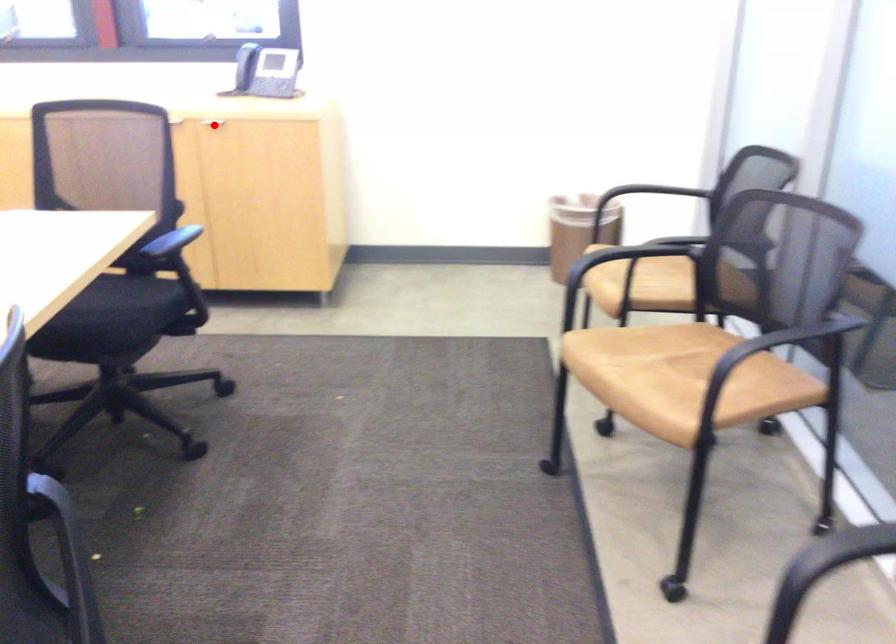
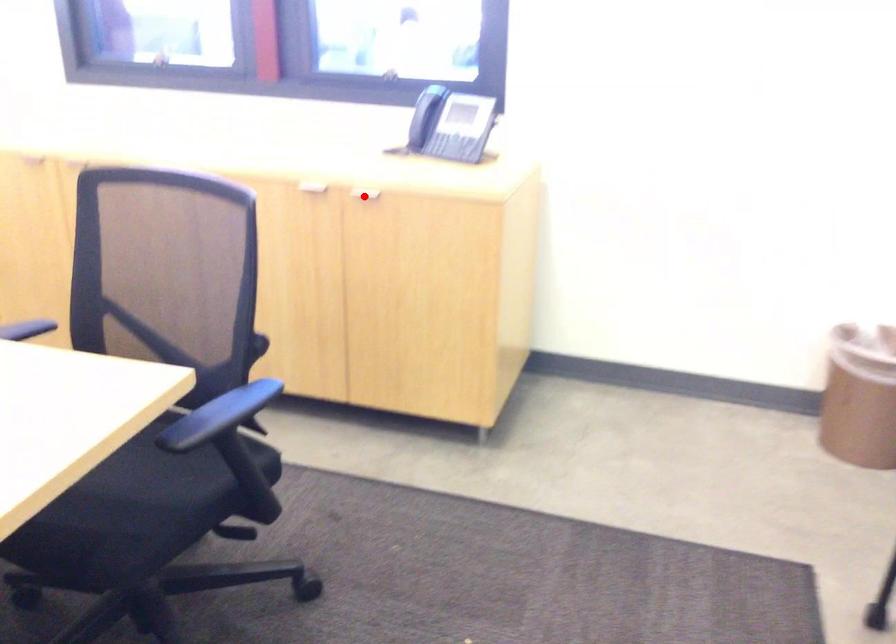
I am providing you with two images of the same scene from different viewpoints. A red point is marked on the first image and another point is marked on the second image. Does the point marked in image1 correspond to the same location as the one in image2?

Yes